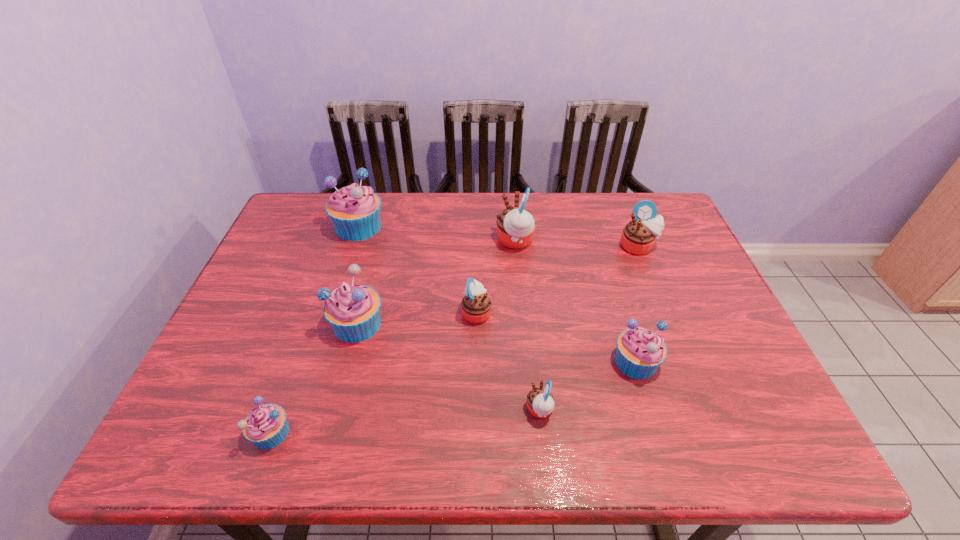
Locate an element on the screen. This screenshot has width=960, height=540. the nearest pink muffin is located at coordinates (540, 401).

This screenshot has height=540, width=960. I want to click on vacant region located on the front-facing side of the biggest pink muffin, so click(479, 241).

Identify the location of vacant space situated 0.350m on the front-facing side of the biggest pink muffin. (381, 241).

Locate an element on the screen. The height and width of the screenshot is (540, 960). free space located on the front-facing side of the biggest pink muffin is located at coordinates (437, 241).

Locate an element on the screen. This screenshot has width=960, height=540. vacant space located on the right of the biggest blue muffin is located at coordinates (502, 227).

Where is `vacant region located on the front of the second biggest blue muffin`? The width and height of the screenshot is (960, 540). vacant region located on the front of the second biggest blue muffin is located at coordinates pos(345,374).

At what (x,y) coordinates should I click in order to perform the action: click on vacant space located 0.120m on the front-facing side of the rightmost pink muffin. Please return your answer as a coordinate pair (x, y). The width and height of the screenshot is (960, 540). Looking at the image, I should click on (654, 286).

The width and height of the screenshot is (960, 540). I want to click on vacant space located on the front-facing side of the fourth muffin from left to right, so click(538, 313).

Identify the location of free space located 0.270m on the left of the rightmost blue muffin. (496, 361).

This screenshot has height=540, width=960. Identify the location of vacant space located 0.100m on the left of the smallest blue muffin. pyautogui.click(x=202, y=433).